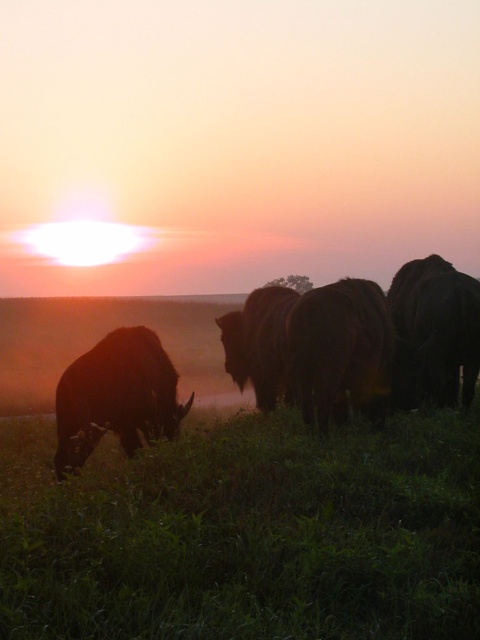
Is point (396, 550) closer to camera compared to point (455, 284)?

Yes.

Is green grassy at lower left wider than dark brown fur at right?

Correct, the width of green grassy at lower left exceeds that of dark brown fur at right.

Where is `green grassy at lower left`? green grassy at lower left is located at coordinates (247, 531).

At what (x,y) coordinates should I click in order to perform the action: click on green grassy at lower left. Please return your answer as a coordinate pair (x, y). The width and height of the screenshot is (480, 640). Looking at the image, I should click on (247, 531).

Is green grassy at lower left further to camera compared to brown fuzzy bison at center?

No, green grassy at lower left is closer to the viewer.

Between point (446, 580) and point (437, 285), which one is positioned in front?

Point (446, 580) is more forward.

At what (x,y) coordinates should I click in order to perform the action: click on green grassy at lower left. Please return your answer as a coordinate pair (x, y). Looking at the image, I should click on (247, 531).

Where is `dark brown fur at lower left`? The height and width of the screenshot is (640, 480). dark brown fur at lower left is located at coordinates (116, 396).

Image resolution: width=480 pixels, height=640 pixels. Describe the element at coordinates (116, 396) in the screenshot. I see `dark brown fur at lower left` at that location.

In order to click on dark brown fur at lower left in this screenshot , I will do `click(116, 396)`.